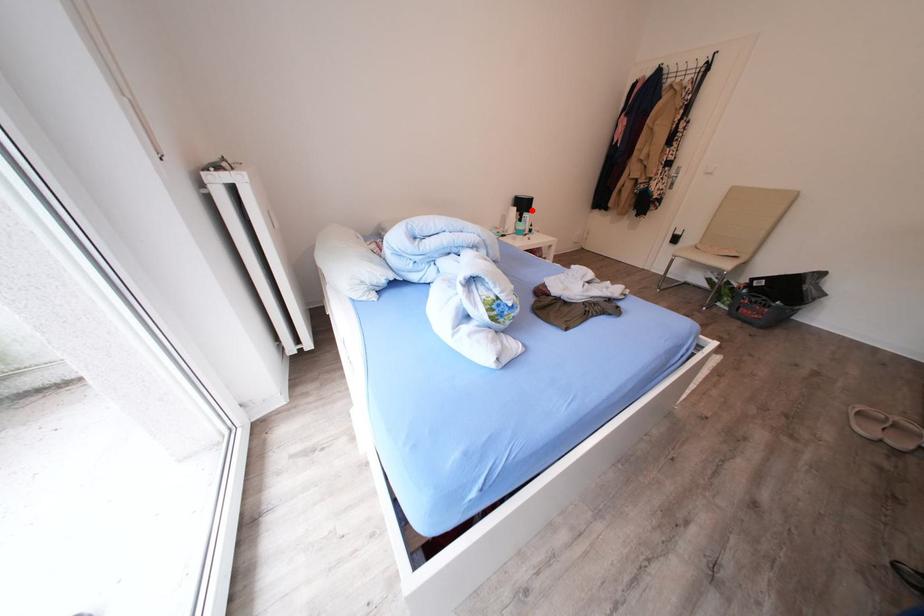
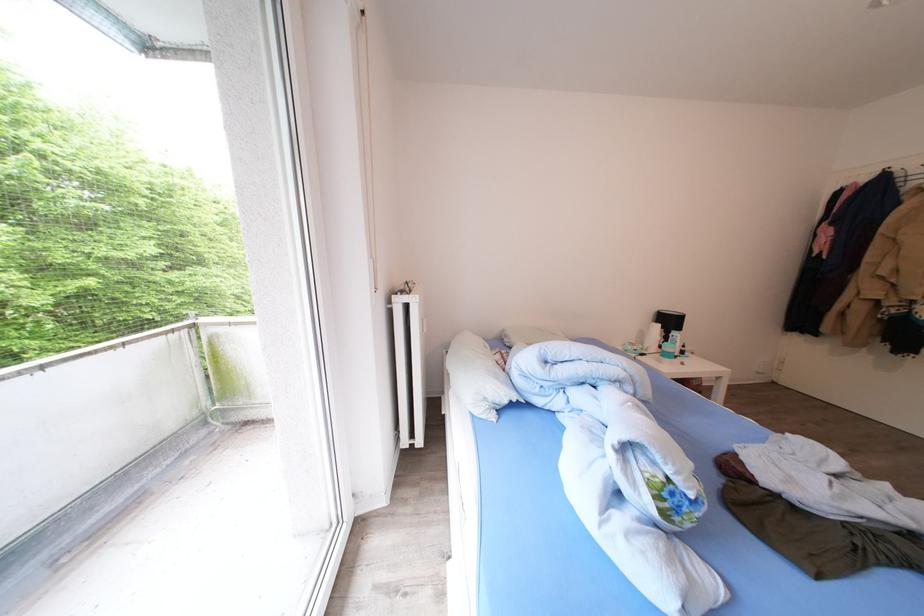
Question: I am providing you with two images of the same scene from different viewpoints. Image1 has a red point marked. In image2, the corresponding 3D location appears at what relative position? Reply with the corresponding letter.

Choices:
 (A) Closer
 (B) Farther

Answer: (B)